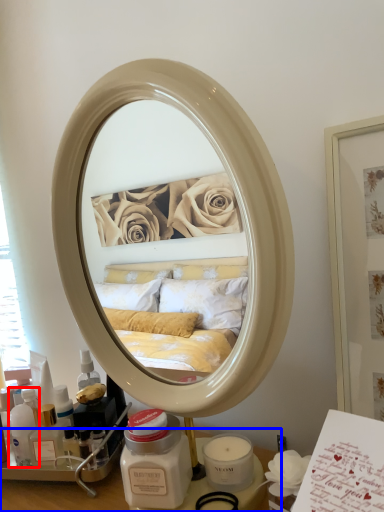
Question: Which point is closer to the camera, toiletry (highlighted by a red box) or vanity (highlighted by a blue box)?

Choices:
 (A) toiletry
 (B) vanity

Answer: (B)